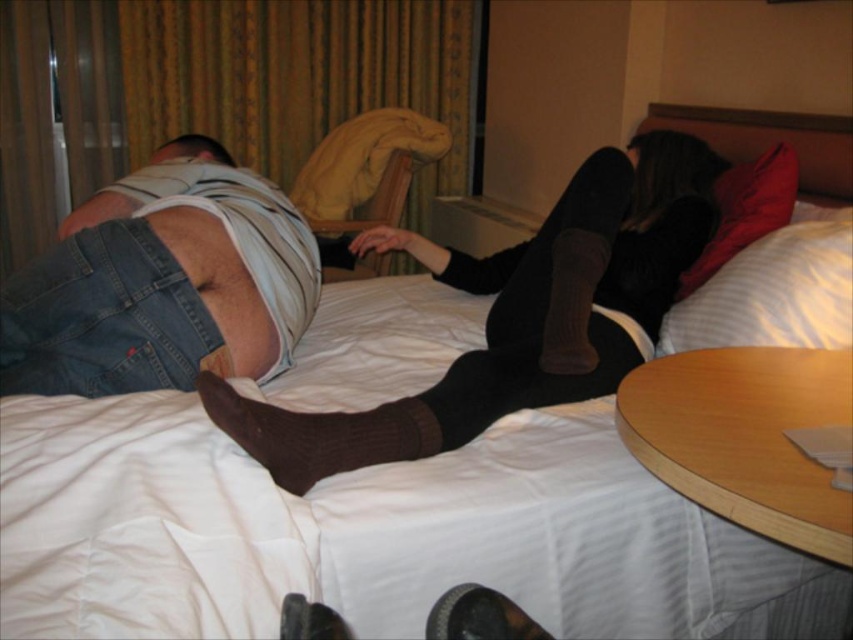
Question: Which point is farther from the camera taking this photo?

Choices:
 (A) (263, 228)
 (B) (706, 264)
 (C) (505, 296)

Answer: (B)

Question: In this image, where is brown knitted sock at center located relative to red soft pillow at upper right?

Choices:
 (A) left
 (B) right

Answer: (A)

Question: Which point is farther from the camera taking this photo?

Choices:
 (A) (370, 426)
 (B) (267, 304)
 (C) (471, 592)

Answer: (B)

Question: Is white striped pillow at upper right to the right of brown knitted sock at center from the viewer's perspective?

Choices:
 (A) yes
 (B) no

Answer: (A)

Question: Which point appears closest to the camera in this image?

Choices:
 (A) click(x=450, y=616)
 (B) click(x=820, y=212)

Answer: (A)

Question: Does black ribbed socks at center appear on the left side of brown knitted sock at center?

Choices:
 (A) no
 (B) yes

Answer: (A)